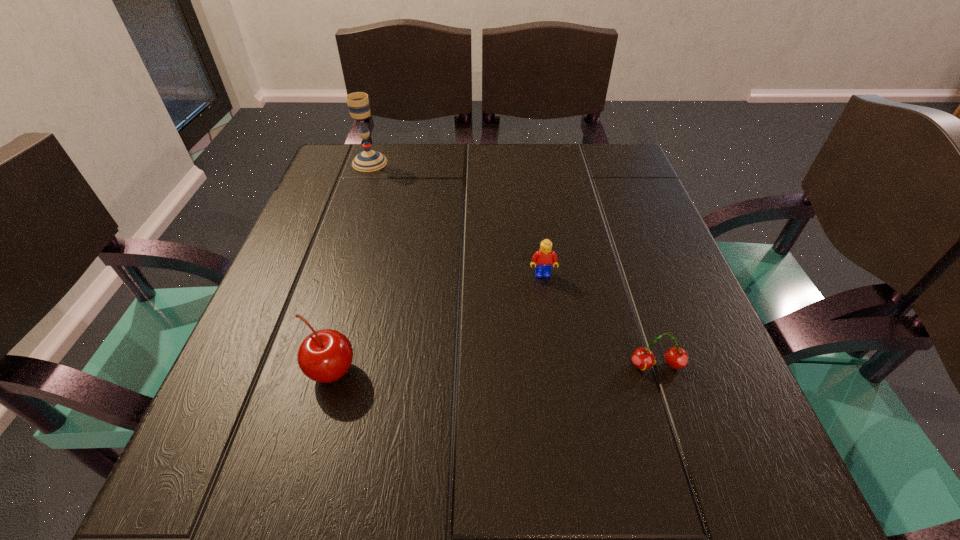
The width and height of the screenshot is (960, 540). What are the coordinates of `vacant space situated on the front-facing side of the Lego` in the screenshot? It's located at (552, 340).

Locate an element on the screen. The width and height of the screenshot is (960, 540). blank area located with stems pointing upwards on the shorter cherry is located at coordinates click(703, 503).

The width and height of the screenshot is (960, 540). In order to click on object that is positioned at the far edge in this screenshot , I will do [x=368, y=160].

At what (x,y) coordinates should I click in order to perform the action: click on chalice positioned at the left edge. Please return your answer as a coordinate pair (x, y). Looking at the image, I should click on (368, 160).

Locate an element on the screen. cherry positioned at the left edge is located at coordinates (324, 356).

Where is `object positioned at the right edge`? Image resolution: width=960 pixels, height=540 pixels. object positioned at the right edge is located at coordinates (643, 358).

The image size is (960, 540). I want to click on object located at the far left corner, so click(368, 160).

This screenshot has width=960, height=540. Find the location of `free space at the far edge of the desktop`. free space at the far edge of the desktop is located at coordinates (467, 144).

The image size is (960, 540). In the image, there is a desktop. What are the coordinates of `vacant space at the near edge` in the screenshot? It's located at (536, 474).

Identify the location of vacant space at the left edge of the desktop. This screenshot has height=540, width=960. (372, 203).